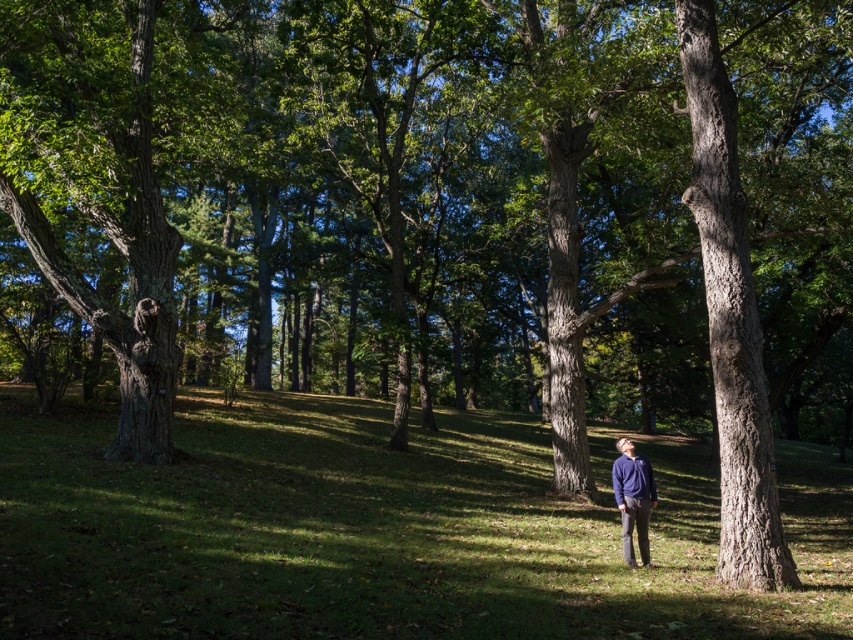
You are a photographer trying to capture a closeup of the green grass at center and the matte blue sweater at center. Which object should you focus on if you want the one that is taller to be in sharp focus?

The green grass at center is much taller than the matte blue sweater at center, so you should focus on the green grass at center to ensure it is in sharp focus.

You are a photographer trying to capture a person in a matte blue sweater at center standing on green grass at center. Can you confirm if the person is standing on the grass?

The green grass at center is positioned under matte blue sweater at center, so yes, the person is standing on the green grass at center.